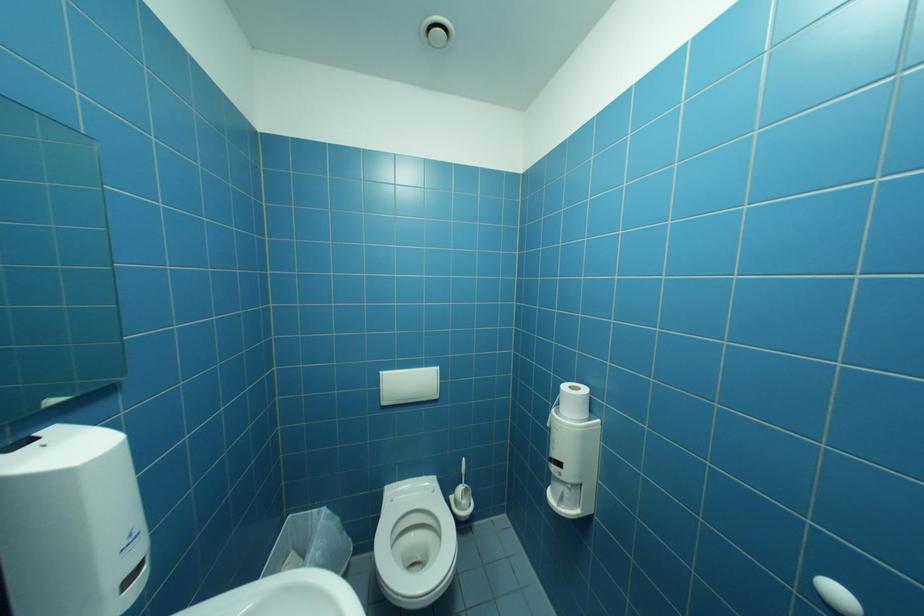
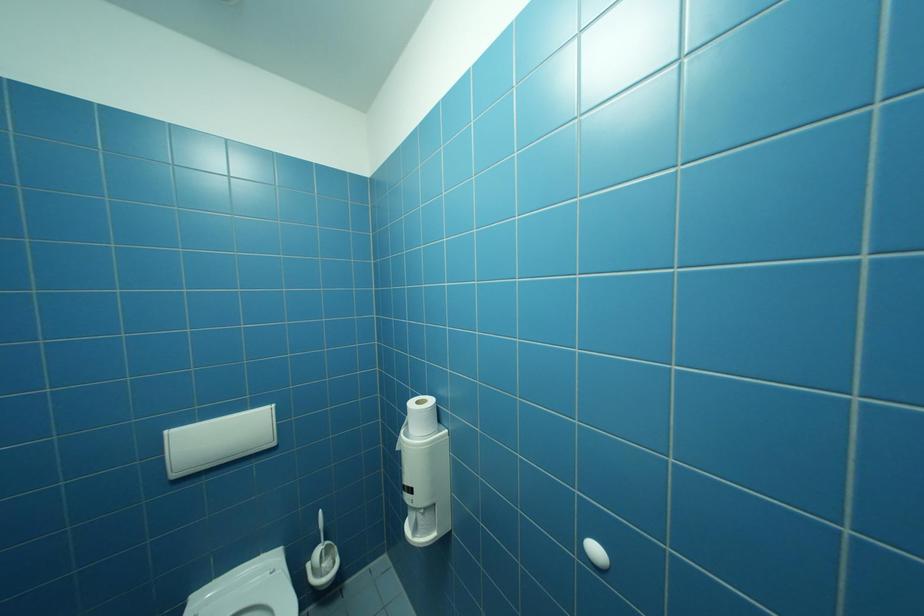
Question: The camera is either moving clockwise (left) or counter-clockwise (right) around the object. The first image is from the beginning of the video and the second image is from the end. Is the camera moving left or right when shooting the video?

Choices:
 (A) Left
 (B) Right

Answer: (A)